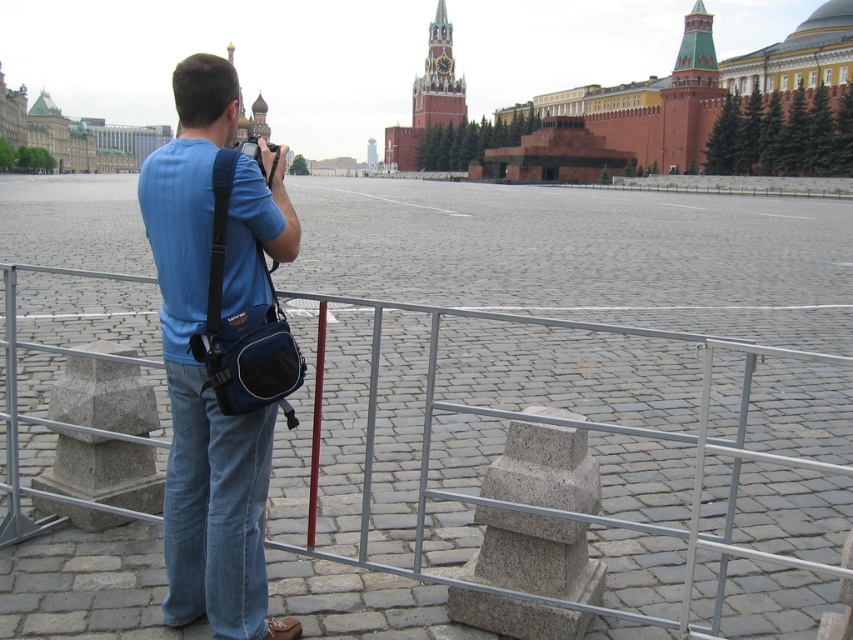
Question: Is blue fabric bag at center thinner than metallic silver fence at center?

Choices:
 (A) yes
 (B) no

Answer: (A)

Question: Among these objects, which one is nearest to the camera?

Choices:
 (A) blue fabric bag at center
 (B) metallic silver fence at center

Answer: (B)

Question: Is blue fabric bag at center thinner than metallic silver fence at center?

Choices:
 (A) yes
 (B) no

Answer: (A)

Question: Which object is closer to the camera taking this photo?

Choices:
 (A) blue fabric bag at center
 (B) metallic silver fence at center

Answer: (B)

Question: Does blue fabric bag at center appear on the left side of metallic silver fence at center?

Choices:
 (A) yes
 (B) no

Answer: (A)